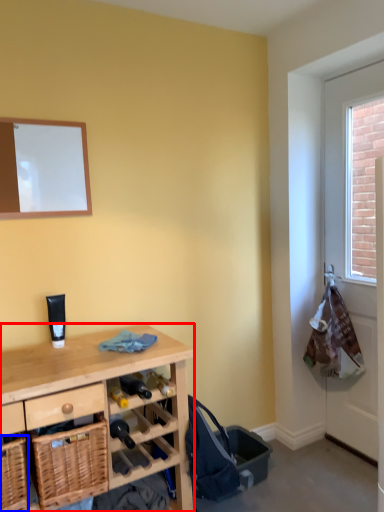
Question: Which object appears closest to the camera in this image, desk (highlighted by a red box) or basket (highlighted by a blue box)?

Choices:
 (A) desk
 (B) basket

Answer: (A)